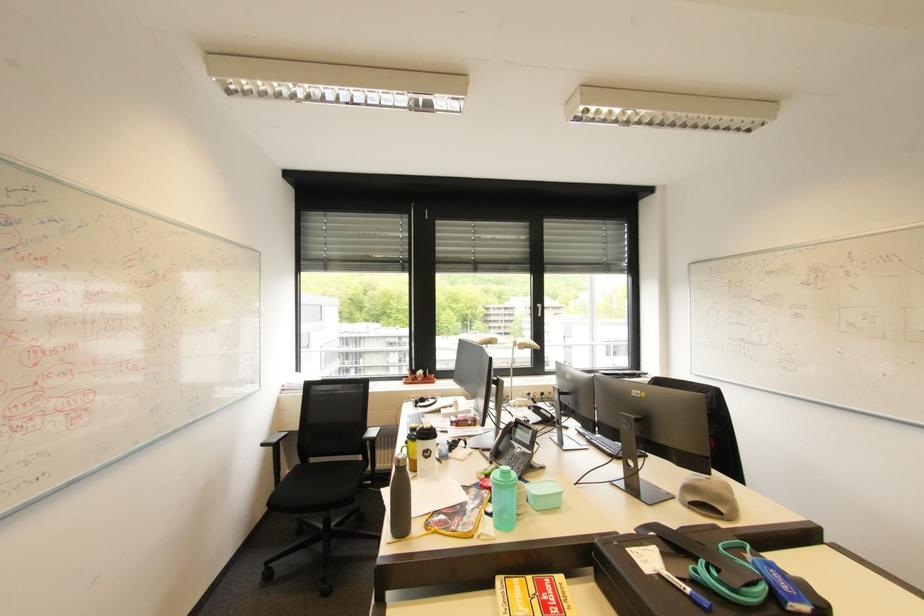
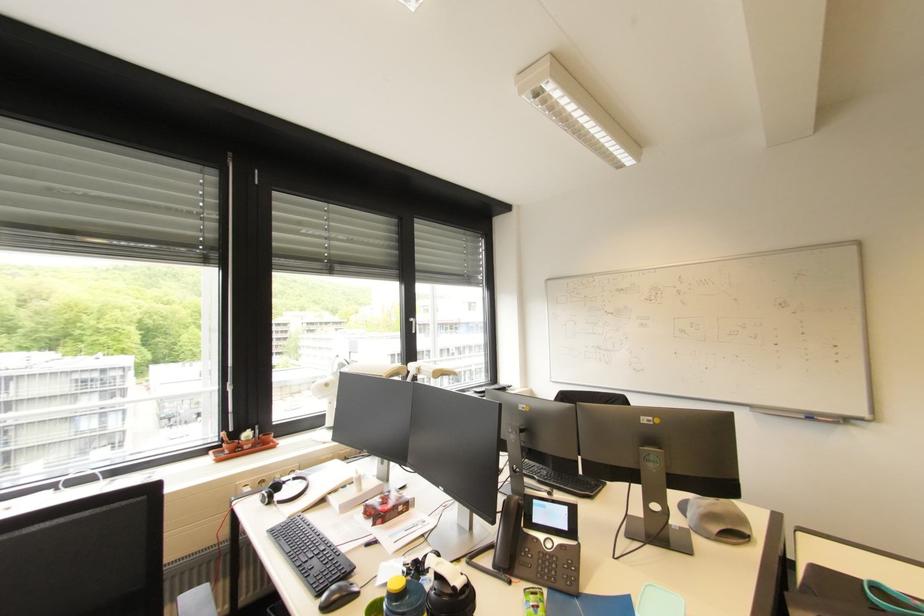
The point at (426, 405) is marked in the first image. Where is the corresponding point in the second image?

(283, 498)